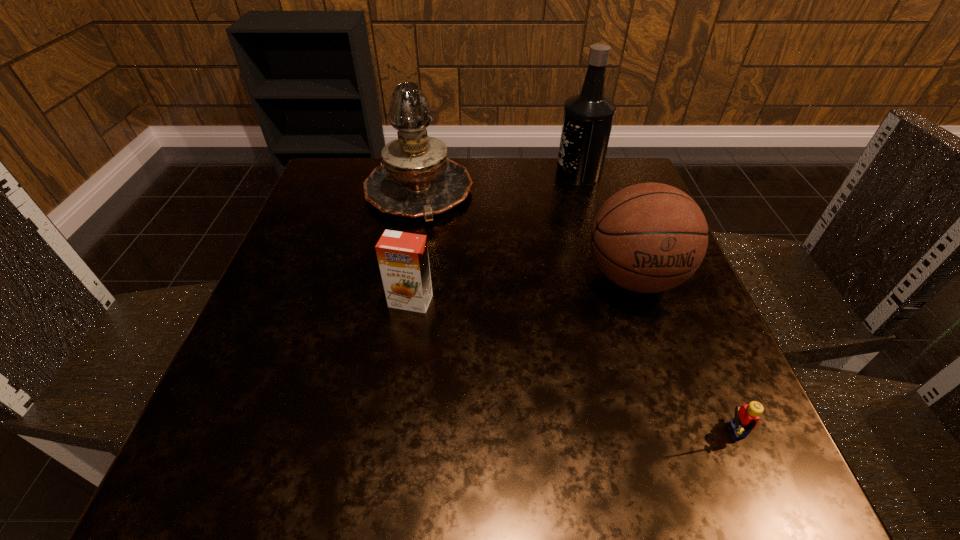
The height and width of the screenshot is (540, 960). In order to click on liquor in this screenshot , I will do `click(588, 117)`.

The width and height of the screenshot is (960, 540). Find the location of `oil lamp`. oil lamp is located at coordinates (416, 179).

I want to click on the third shortest object, so click(650, 237).

At what (x,y) coordinates should I click in order to perform the action: click on orange juice. Please return your answer as a coordinate pair (x, y). The image size is (960, 540). Looking at the image, I should click on (403, 259).

This screenshot has height=540, width=960. What are the coordinates of `the shortest object` in the screenshot? It's located at (746, 418).

This screenshot has width=960, height=540. Find the location of `Lego`. Lego is located at coordinates (746, 418).

The width and height of the screenshot is (960, 540). What are the coordinates of `vacant space located 0.240m on the front label of the tallest object` in the screenshot? It's located at (460, 173).

This screenshot has height=540, width=960. What are the coordinates of `vacant space located on the front label of the tallest object` in the screenshot? It's located at (455, 173).

Identify the location of vacant region located 0.240m on the front label of the tallest object. (460, 173).

Image resolution: width=960 pixels, height=540 pixels. I want to click on blank space located on the right of the oil lamp, so click(x=579, y=193).